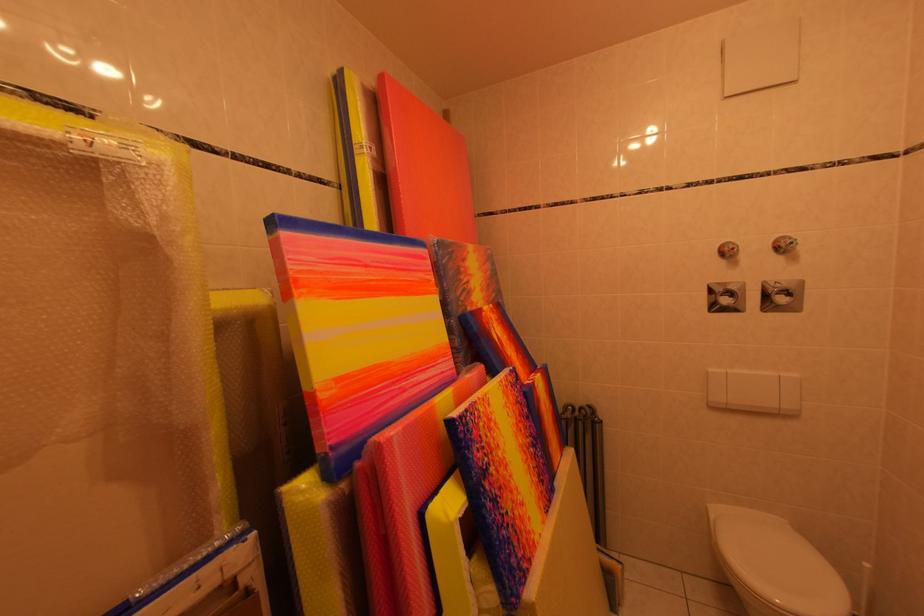
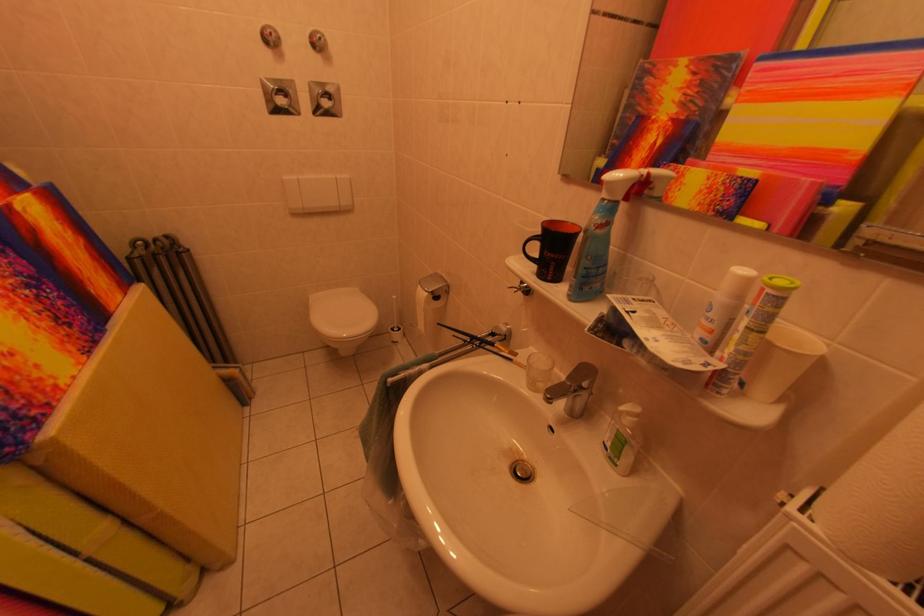
Where in the second image is the point corresponding to point (742, 253) from the first image?

(278, 39)